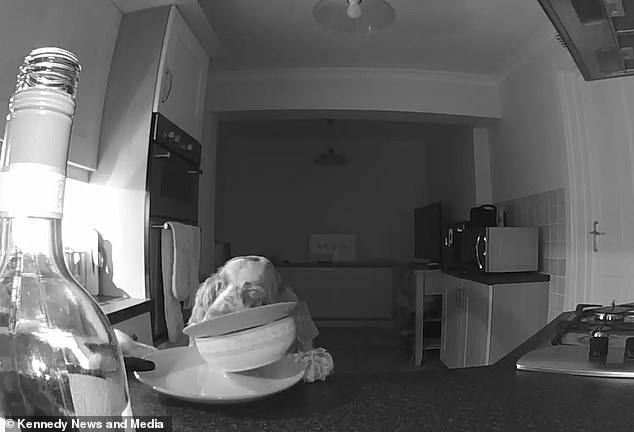
Locate an element on the screen. The image size is (634, 432). door handle is located at coordinates pyautogui.click(x=595, y=233).